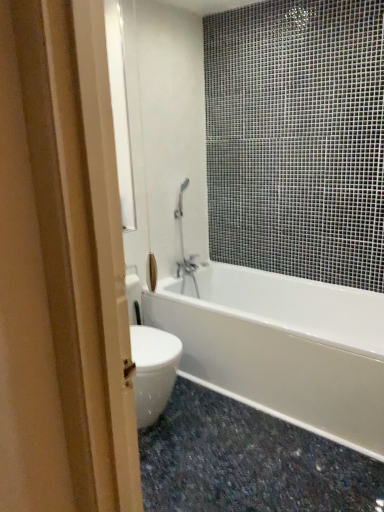
Question: Looking at their shapes, would you say granite at lower right is wider or thinner than white glossy bathtub at center?

Choices:
 (A) wide
 (B) thin

Answer: (A)

Question: From a real-world perspective, is granite at lower right physically located above or below white glossy bathtub at center?

Choices:
 (A) above
 (B) below

Answer: (B)

Question: From their relative heights in the image, would you say granite at lower right is taller or shorter than white glossy bathtub at center?

Choices:
 (A) short
 (B) tall

Answer: (A)

Question: From a real-world perspective, is white glossy bathtub at center physically located above or below granite at lower right?

Choices:
 (A) below
 (B) above

Answer: (B)

Question: Is white glossy bathtub at center taller or shorter than granite at lower right?

Choices:
 (A) short
 (B) tall

Answer: (B)

Question: In the image, is white glossy bathtub at center positioned in front of or behind granite at lower right?

Choices:
 (A) front
 (B) behind

Answer: (B)

Question: Does point coord(281,345) appear closer or farther from the camera than point coord(231,505)?

Choices:
 (A) closer
 (B) farther

Answer: (B)